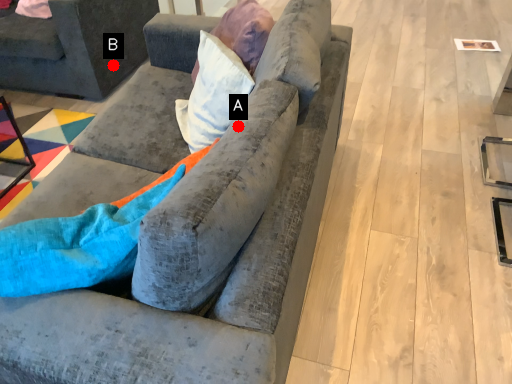
Question: Two points are circled on the image, labeled by A and B beside each circle. Which of the following is the closest to the observer?

Choices:
 (A) A is closer
 (B) B is closer

Answer: (A)